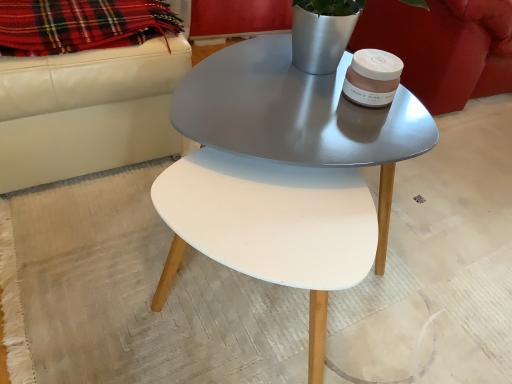
Question: From a real-world perspective, is plaid wool blanket at upper left positioned under metallic gray coffee table at center based on gravity?

Choices:
 (A) yes
 (B) no

Answer: (B)

Question: From the image's perspective, is plaid wool blanket at upper left beneath metallic gray coffee table at center?

Choices:
 (A) yes
 (B) no

Answer: (B)

Question: Is plaid wool blanket at upper left located outside metallic gray coffee table at center?

Choices:
 (A) no
 (B) yes

Answer: (B)

Question: Can you confirm if plaid wool blanket at upper left is taller than metallic gray coffee table at center?

Choices:
 (A) no
 (B) yes

Answer: (A)

Question: Is plaid wool blanket at upper left positioned before metallic gray coffee table at center?

Choices:
 (A) yes
 (B) no

Answer: (B)

Question: From a real-world perspective, is plaid wool blanket at upper left over metallic gray coffee table at center?

Choices:
 (A) no
 (B) yes

Answer: (B)

Question: Considering the relative sizes of metallic gray coffee table at center and velvet red armchair at upper right in the image provided, is metallic gray coffee table at center shorter than velvet red armchair at upper right?

Choices:
 (A) yes
 (B) no

Answer: (A)

Question: Can you confirm if metallic gray coffee table at center is taller than velvet red armchair at upper right?

Choices:
 (A) yes
 (B) no

Answer: (B)

Question: Does metallic gray coffee table at center have a smaller size compared to velvet red armchair at upper right?

Choices:
 (A) no
 (B) yes

Answer: (B)

Question: Is metallic gray coffee table at center to the left of velvet red armchair at upper right from the viewer's perspective?

Choices:
 (A) no
 (B) yes

Answer: (B)

Question: From a real-world perspective, is metallic gray coffee table at center positioned over velvet red armchair at upper right based on gravity?

Choices:
 (A) yes
 (B) no

Answer: (B)

Question: Does metallic gray coffee table at center have a lesser width compared to velvet red armchair at upper right?

Choices:
 (A) yes
 (B) no

Answer: (A)

Question: Is plaid wool blanket at upper left oriented towards velvet red armchair at upper right?

Choices:
 (A) no
 (B) yes

Answer: (B)